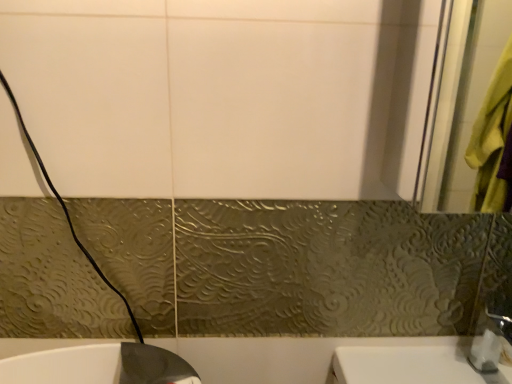
This screenshot has height=384, width=512. Identify the location of white glossy sink at lower left. (97, 365).

What do you see at coordinates (97, 365) in the screenshot? The height and width of the screenshot is (384, 512). I see `white glossy sink at lower left` at bounding box center [97, 365].

Locate an element on the screen. This screenshot has width=512, height=384. white glossy sink at lower left is located at coordinates (97, 365).